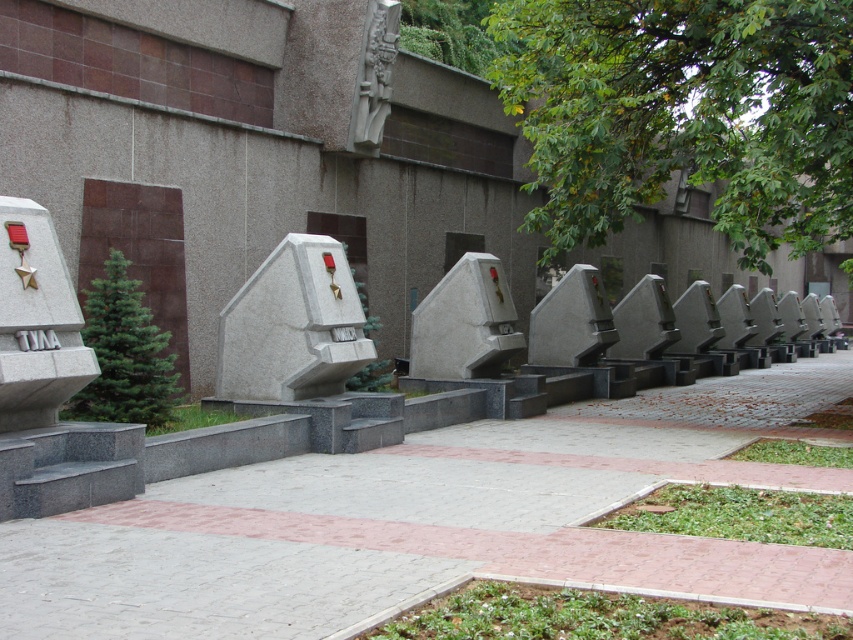
Is white stone sculpture at center closer to camera compared to gray stone carving at upper center?

Yes, white stone sculpture at center is closer to the viewer.

Where is `white stone sculpture at center`? white stone sculpture at center is located at coordinates (293, 324).

Describe the element at coordinates (293, 324) in the screenshot. I see `white stone sculpture at center` at that location.

What do you see at coordinates (293, 324) in the screenshot? Image resolution: width=853 pixels, height=640 pixels. I see `white stone sculpture at center` at bounding box center [293, 324].

Where is `white stone sculpture at center`? white stone sculpture at center is located at coordinates (293, 324).

Who is shorter, white marble sculpture at center or gray stone carving at upper center?

Standing shorter between the two is white marble sculpture at center.

Which is in front, point (428, 308) or point (360, 80)?

Positioned in front is point (428, 308).

At what (x,y) coordinates should I click in order to perform the action: click on white marble sculpture at center. Please return your answer as a coordinate pair (x, y). The width and height of the screenshot is (853, 640). Looking at the image, I should click on (463, 323).